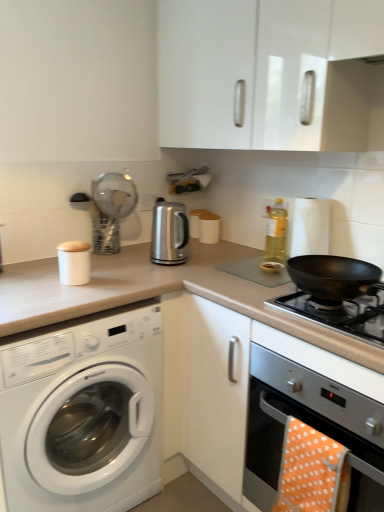
This screenshot has height=512, width=384. What are the coordinates of `glossy white cabinet at upper center` in the screenshot? It's located at (269, 73).

Where is `black matte pan at right`? The width and height of the screenshot is (384, 512). black matte pan at right is located at coordinates (340, 313).

This screenshot has height=512, width=384. What do you see at coordinates (74, 262) in the screenshot?
I see `white matte container at upper left, acting as the fourth appliance starting from the right` at bounding box center [74, 262].

The width and height of the screenshot is (384, 512). What do you see at coordinates (312, 471) in the screenshot? I see `orange polka dot towel at lower right` at bounding box center [312, 471].

This screenshot has width=384, height=512. Describe the element at coordinates (111, 209) in the screenshot. I see `metal mesh strainer at upper center, the third appliance when ordered from right to left` at that location.

What are the coordinates of `white paper towel at upper right, positioned as the first appliance in right-to-left order` in the screenshot? It's located at (307, 226).

Can you confirm if orange polka dot towel at lower right is bigger than black matte pan at right?

No.

In order to click on gas stove in front of the orange polka dot towel at lower right in this screenshot , I will do `click(340, 313)`.

Consider the image. Could you tell me if orange polka dot towel at lower right is facing black matte pan at right?

No, orange polka dot towel at lower right is not turned towards black matte pan at right.

Considering the relative positions of orange polka dot towel at lower right and black matte pan at right in the image provided, is orange polka dot towel at lower right behind black matte pan at right?

Yes, the depth of orange polka dot towel at lower right is greater than that of black matte pan at right.

Is point (132, 267) farther from viewer compared to point (313, 424)?

Yes.

Between beige laminate countertop at center and satin silver oven at lower right, which one has larger size?

With larger size is beige laminate countertop at center.

Which of these two, beige laminate countertop at center or satin silver oven at lower right, stands shorter?

With less height is satin silver oven at lower right.

Is the position of beige laminate countertop at center less distant than that of satin silver oven at lower right?

No, the depth of beige laminate countertop at center is greater than that of satin silver oven at lower right.

Measure the distance between yellow translucent bottle at upper right and white glossy washing machine at left.

36.33 inches.

Could white glossy washing machine at left be considered to be inside yellow translucent bottle at upper right?

No.

Can you confirm if yellow translucent bottle at upper right is smaller than white glossy washing machine at left?

Yes.

Considering the sizes of objects yellow translucent bottle at upper right and white glossy washing machine at left in the image provided, who is shorter, yellow translucent bottle at upper right or white glossy washing machine at left?

Standing shorter between the two is yellow translucent bottle at upper right.

From a real-world perspective, between white paper towel at upper right, the fourth appliance positioned from the left, and metal mesh strainer at upper center, the 2th appliance in the left-to-right sequence, who is vertically lower?

In real-world perspective, white paper towel at upper right, the fourth appliance positioned from the left, is lower.

Does white paper towel at upper right, positioned as the first appliance in right-to-left order, have a lesser width compared to metal mesh strainer at upper center, the third appliance when ordered from right to left?

Yes.

Which of these two, white paper towel at upper right, positioned as the first appliance in right-to-left order, or metal mesh strainer at upper center, the third appliance when ordered from right to left, is bigger?

A: Bigger between the two is metal mesh strainer at upper center, the third appliance when ordered from right to left.

Which is behind, point (301, 225) or point (119, 239)?

The point (119, 239) is more distant.

Considering the relative positions of satin silver oven at lower right and yellow translucent bottle at upper right in the image provided, is satin silver oven at lower right to the right of yellow translucent bottle at upper right from the viewer's perspective?

Indeed, satin silver oven at lower right is positioned on the right side of yellow translucent bottle at upper right.

Is satin silver oven at lower right aimed at yellow translucent bottle at upper right?

No, satin silver oven at lower right is not facing towards yellow translucent bottle at upper right.

Is satin silver oven at lower right not inside yellow translucent bottle at upper right?

Yes.

Which object is further away from the camera, satin silver oven at lower right or yellow translucent bottle at upper right?

yellow translucent bottle at upper right is further away from the camera.

Considering the sizes of white paper towel at upper right, positioned as the first appliance in right-to-left order, and beige laminate countertop at center in the image, is white paper towel at upper right, positioned as the first appliance in right-to-left order, bigger or smaller than beige laminate countertop at center?

Considering their sizes, white paper towel at upper right, positioned as the first appliance in right-to-left order, takes up less space than beige laminate countertop at center.

Between white paper towel at upper right, the fourth appliance positioned from the left, and beige laminate countertop at center, which one is positioned in front?

beige laminate countertop at center is more forward.

How many degrees apart are the facing directions of white paper towel at upper right, positioned as the first appliance in right-to-left order, and beige laminate countertop at center?

88.7 degrees.

Can you tell me how much satin silver kettle at center, which is counted as the 2th appliance, starting from the right, and orange polka dot towel at lower right differ in facing direction?

The angular difference between satin silver kettle at center, which is counted as the 2th appliance, starting from the right, and orange polka dot towel at lower right is 90 degrees.

From the image's perspective, is satin silver kettle at center, which is counted as the 2th appliance, starting from the right, above orange polka dot towel at lower right?

Yes, from the image's perspective, satin silver kettle at center, which is counted as the 2th appliance, starting from the right, is over orange polka dot towel at lower right.

Can you confirm if satin silver kettle at center, arranged as the third appliance when viewed from the left, is smaller than orange polka dot towel at lower right?

Actually, satin silver kettle at center, arranged as the third appliance when viewed from the left, might be larger than orange polka dot towel at lower right.

This screenshot has height=512, width=384. Find the location of `material that appears on the left of black matte pan at right`. material that appears on the left of black matte pan at right is located at coordinates (312, 471).

This screenshot has height=512, width=384. In order to click on counter that is behind the satin silver oven at lower right in this screenshot , I will do `click(159, 294)`.

Looking at the image, which one is located closer to black matte wok at right, beige laminate countertop at center or yellow translucent bottle at upper right?

beige laminate countertop at center lies closer to black matte wok at right than the other object.

Looking at this image, from the image, which object appears to be nearer to white paper towel at upper right, the fourth appliance positioned from the left, glossy white cabinet at upper center or metal mesh strainer at upper center, the third appliance when ordered from right to left?

Based on the image, glossy white cabinet at upper center appears to be nearer to white paper towel at upper right, the fourth appliance positioned from the left.

From the image, which object appears to be farther from orange polka dot towel at lower right, yellow translucent bottle at upper right or satin silver kettle at center, arranged as the third appliance when viewed from the left?

The object further to orange polka dot towel at lower right is satin silver kettle at center, arranged as the third appliance when viewed from the left.

In the scene shown: Which object lies further to the anchor point yellow translucent bottle at upper right, satin silver kettle at center, arranged as the third appliance when viewed from the left, or beige laminate countertop at center?

Based on the image, beige laminate countertop at center appears to be further to yellow translucent bottle at upper right.

From the image, which object appears to be farther from orange polka dot towel at lower right, black matte pan at right or metal mesh strainer at upper center, the third appliance when ordered from right to left?

metal mesh strainer at upper center, the third appliance when ordered from right to left, is positioned further to the anchor orange polka dot towel at lower right.

Considering their positions, is black matte pan at right positioned closer to black matte wok at right than satin silver oven at lower right?

Among the two, black matte pan at right is located nearer to black matte wok at right.

Which object lies further to the anchor point metal mesh strainer at upper center, the third appliance when ordered from right to left, white matte container at upper left, arranged as the 1th appliance when viewed from the left, or satin silver kettle at center, arranged as the third appliance when viewed from the left?

white matte container at upper left, arranged as the 1th appliance when viewed from the left.

Based on their spatial positions, is yellow translucent bottle at upper right or white matte container at upper left, acting as the fourth appliance starting from the right, closer to satin silver oven at lower right?

The object closer to satin silver oven at lower right is yellow translucent bottle at upper right.

This screenshot has height=512, width=384. I want to click on counter situated between white matte container at upper left, arranged as the 1th appliance when viewed from the left, and black matte pan at right from left to right, so click(x=159, y=294).

This screenshot has height=512, width=384. I want to click on material located between white glossy washing machine at left and white paper towel at upper right, the fourth appliance positioned from the left, in the left-right direction, so click(x=312, y=471).

Where is `oven between satin silver kettle at center, arranged as the third appliance when viewed from the left, and orange polka dot towel at lower right from top to bottom`? The height and width of the screenshot is (512, 384). oven between satin silver kettle at center, arranged as the third appliance when viewed from the left, and orange polka dot towel at lower right from top to bottom is located at coordinates (301, 419).

In order to click on gas stove between black matte wok at right and satin silver oven at lower right in the vertical direction in this screenshot , I will do `click(340, 313)`.